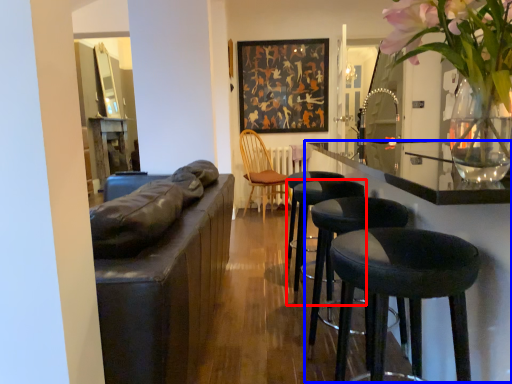
Question: Which of the following is the closest to the observer, stool (highlighted by a red box) or counter top (highlighted by a blue box)?

Choices:
 (A) stool
 (B) counter top

Answer: (B)